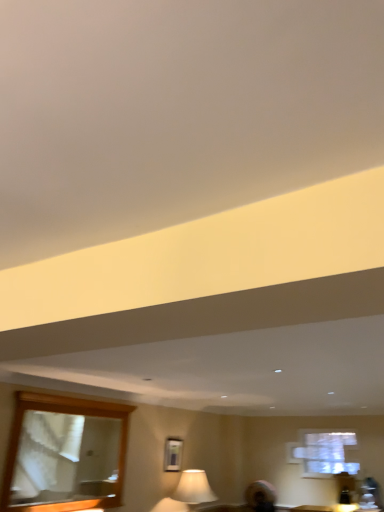
Locate an element on the screen. Image resolution: width=384 pixels, height=512 pixels. metallic silver picture frame at center is located at coordinates (173, 454).

Image resolution: width=384 pixels, height=512 pixels. Describe the element at coordinates (173, 454) in the screenshot. I see `metallic silver picture frame at center` at that location.

Measure the distance between metallic silver picture frame at center and camera.

metallic silver picture frame at center is 5.76 meters from camera.

Where is `wooden-framed mirror at lower left`? wooden-framed mirror at lower left is located at coordinates (65, 459).

What do you see at coordinates (65, 459) in the screenshot? I see `wooden-framed mirror at lower left` at bounding box center [65, 459].

This screenshot has width=384, height=512. Identify the location of metallic silver picture frame at center. (173, 454).

In the image, is metallic silver picture frame at center on the left side or the right side of wooden-framed mirror at lower left?

metallic silver picture frame at center is positioned on wooden-framed mirror at lower left's right side.

Is metallic silver picture frame at center in front of or behind wooden-framed mirror at lower left in the image?

metallic silver picture frame at center is behind wooden-framed mirror at lower left.

Is point (177, 471) positioned behind point (47, 465)?

Yes.

From the image's perspective, would you say metallic silver picture frame at center is shown under wooden-framed mirror at lower left?

Yes.

From a real-world perspective, is metallic silver picture frame at center under wooden-framed mirror at lower left?

Indeed, from a real-world perspective, metallic silver picture frame at center is positioned beneath wooden-framed mirror at lower left.

Considering the sizes of metallic silver picture frame at center and wooden-framed mirror at lower left in the image, is metallic silver picture frame at center wider or thinner than wooden-framed mirror at lower left?

metallic silver picture frame at center is thinner than wooden-framed mirror at lower left.

Does metallic silver picture frame at center have a lesser height compared to wooden-framed mirror at lower left?

Yes, metallic silver picture frame at center is shorter than wooden-framed mirror at lower left.

Can you confirm if metallic silver picture frame at center is smaller than wooden-framed mirror at lower left?

Yes.

Choose the correct answer: Is metallic silver picture frame at center inside wooden-framed mirror at lower left or outside it?

metallic silver picture frame at center exists outside the volume of wooden-framed mirror at lower left.

Is metallic silver picture frame at center far away from wooden-framed mirror at lower left?

Yes.

Is metallic silver picture frame at center oriented away from wooden-framed mirror at lower left?

No, wooden-framed mirror at lower left is not at the back of metallic silver picture frame at center.

The width and height of the screenshot is (384, 512). Find the location of `mirror above the metallic silver picture frame at center (from a real-world perspective)`. mirror above the metallic silver picture frame at center (from a real-world perspective) is located at coordinates (65, 459).

Considering the positions of objects wooden-framed mirror at lower left and metallic silver picture frame at center in the image provided, who is more to the right, wooden-framed mirror at lower left or metallic silver picture frame at center?

From the viewer's perspective, metallic silver picture frame at center appears more on the right side.

Which object is closer to the camera taking this photo, wooden-framed mirror at lower left or metallic silver picture frame at center?

wooden-framed mirror at lower left is in front.

Which is farther from the camera, (81, 436) or (172, 463)?

Point (81, 436)

Looking at this image, from the image's perspective, is wooden-framed mirror at lower left on metallic silver picture frame at center?

Indeed, from the image's perspective, wooden-framed mirror at lower left is shown above metallic silver picture frame at center.

From a real-world perspective, which object rests below the other?

metallic silver picture frame at center, from a real-world perspective.

In the scene shown: Considering the relative sizes of wooden-framed mirror at lower left and metallic silver picture frame at center in the image provided, is wooden-framed mirror at lower left wider than metallic silver picture frame at center?

Correct, the width of wooden-framed mirror at lower left exceeds that of metallic silver picture frame at center.

Is wooden-framed mirror at lower left taller or shorter than metallic silver picture frame at center?

Considering their sizes, wooden-framed mirror at lower left has more height than metallic silver picture frame at center.

In terms of size, does wooden-framed mirror at lower left appear bigger or smaller than metallic silver picture frame at center?

Considering their sizes, wooden-framed mirror at lower left takes up more space than metallic silver picture frame at center.

Would you say wooden-framed mirror at lower left is inside or outside metallic silver picture frame at center?

The correct answer is: outside.

Would you consider wooden-framed mirror at lower left to be distant from metallic silver picture frame at center?

Yes.

Does wooden-framed mirror at lower left turn towards metallic silver picture frame at center?

No.

How many degrees apart are the facing directions of wooden-framed mirror at lower left and metallic silver picture frame at center?

3.62 degrees separate the facing orientations of wooden-framed mirror at lower left and metallic silver picture frame at center.

I want to click on mirror above the metallic silver picture frame at center (from the image's perspective), so click(65, 459).

You are a GUI agent. You are given a task and a screenshot of the screen. Output one action in this format:
    pyautogui.click(x=<x>, y=<y>)
    Task: Click on the picture frame below the wooden-framed mirror at lower left (from the image's perspective)
    Image resolution: width=384 pixels, height=512 pixels.
    Given the screenshot: What is the action you would take?
    pyautogui.click(x=173, y=454)

The width and height of the screenshot is (384, 512). I want to click on picture frame located on the right of wooden-framed mirror at lower left, so click(x=173, y=454).